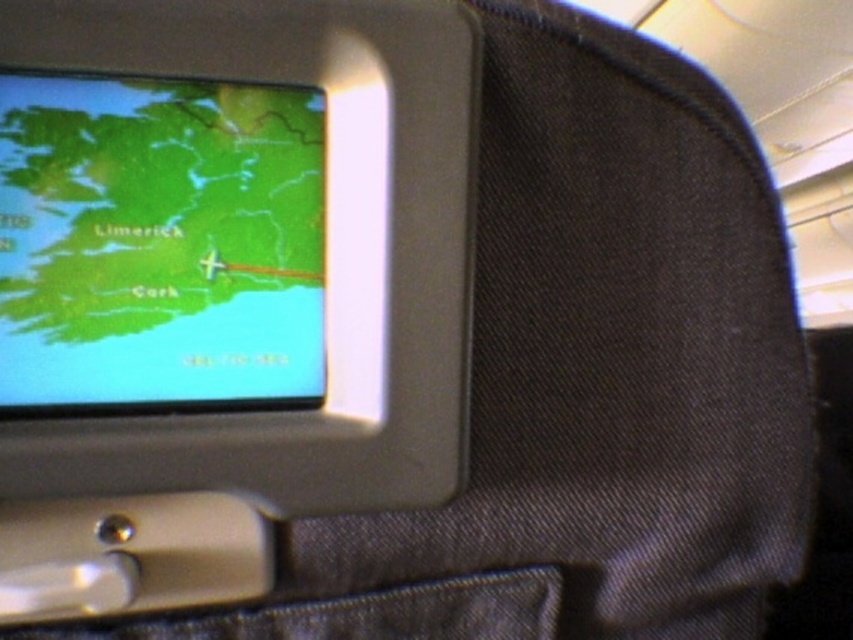
Does matte plastic screen at upper left have a lesser height compared to green matte map at upper left?

No.

You are a GUI agent. You are given a task and a screenshot of the screen. Output one action in this format:
    pyautogui.click(x=<x>, y=<y>)
    Task: Click on the matte plastic screen at upper left
    This screenshot has width=853, height=640.
    Given the screenshot: What is the action you would take?
    pyautogui.click(x=326, y=252)

Identify the location of matte plastic screen at upper left. The image size is (853, 640). (326, 252).

Who is positioned more to the right, matte plastic screen at upper left or denim at lower left?

denim at lower left

Looking at this image, does matte plastic screen at upper left have a greater width compared to denim at lower left?

Incorrect, matte plastic screen at upper left's width does not surpass denim at lower left's.

Is point (462, 413) closer to camera compared to point (422, 634)?

Yes, point (462, 413) is closer to viewer.

Identify the location of matte plastic screen at upper left. The height and width of the screenshot is (640, 853). (326, 252).

Based on the photo, is green matte map at upper left thinner than denim at lower left?

Indeed, green matte map at upper left has a lesser width compared to denim at lower left.

Is green matte map at upper left smaller than denim at lower left?

Incorrect, green matte map at upper left is not smaller in size than denim at lower left.

Who is more forward, [160,172] or [346,632]?

Positioned in front is point [160,172].

This screenshot has height=640, width=853. What are the coordinates of `green matte map at upper left` in the screenshot? It's located at (158, 244).